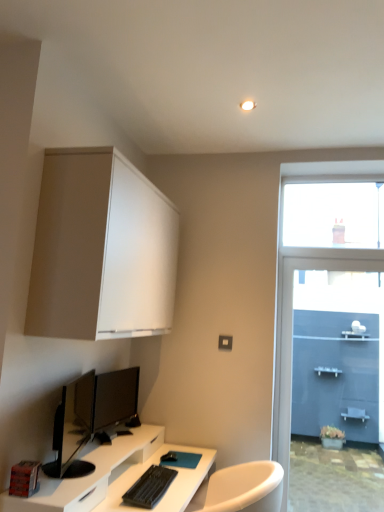
Question: Is transparent glass window at upper right in front of black glossy monitor at lower left, positioned as the 2th computer monitor in back-to-front order?

Choices:
 (A) no
 (B) yes

Answer: (A)

Question: From the image's perspective, is transparent glass window at upper right below black glossy monitor at lower left, placed as the first computer monitor when sorted from front to back?

Choices:
 (A) no
 (B) yes

Answer: (A)

Question: Is transparent glass window at upper right at the left side of black glossy monitor at lower left, positioned as the 2th computer monitor in back-to-front order?

Choices:
 (A) no
 (B) yes

Answer: (A)

Question: Is black glossy monitor at lower left, positioned as the 2th computer monitor in back-to-front order, located within transparent glass window at upper right?

Choices:
 (A) no
 (B) yes

Answer: (A)

Question: From the image's perspective, would you say transparent glass window at upper right is positioned over black glossy monitor at lower left, positioned as the 2th computer monitor in back-to-front order?

Choices:
 (A) yes
 (B) no

Answer: (A)

Question: In the image, is black glossy monitor at center, the 1th computer monitor when ordered from back to front, positioned in front of or behind black glossy monitor at lower left, placed as the first computer monitor when sorted from front to back?

Choices:
 (A) behind
 (B) front

Answer: (A)

Question: Is point (102, 382) positioned closer to the camera than point (87, 393)?

Choices:
 (A) closer
 (B) farther

Answer: (B)

Question: From a real-world perspective, is black glossy monitor at center, the 1th computer monitor when ordered from back to front, physically located above or below black glossy monitor at lower left, positioned as the 2th computer monitor in back-to-front order?

Choices:
 (A) above
 (B) below

Answer: (B)

Question: Looking at the image, does black glossy monitor at center, which appears as the second computer monitor when viewed from the front, seem bigger or smaller compared to black glossy monitor at lower left, positioned as the 2th computer monitor in back-to-front order?

Choices:
 (A) big
 (B) small

Answer: (B)

Question: From a real-world perspective, relative to black glossy monitor at lower left, placed as the first computer monitor when sorted from front to back, is matte white cabinet at upper left vertically above or below?

Choices:
 (A) above
 (B) below

Answer: (A)

Question: Would you say matte white cabinet at upper left is to the left or to the right of black glossy monitor at lower left, placed as the first computer monitor when sorted from front to back, in the picture?

Choices:
 (A) right
 (B) left

Answer: (A)

Question: In terms of width, does matte white cabinet at upper left look wider or thinner when compared to black glossy monitor at lower left, placed as the first computer monitor when sorted from front to back?

Choices:
 (A) wide
 (B) thin

Answer: (A)

Question: From the image's perspective, is matte white cabinet at upper left above or below black glossy monitor at lower left, placed as the first computer monitor when sorted from front to back?

Choices:
 (A) below
 (B) above

Answer: (B)

Question: Considering the positions of transparent glass window at upper right and matte white cabinet at upper left in the image, is transparent glass window at upper right wider or thinner than matte white cabinet at upper left?

Choices:
 (A) wide
 (B) thin

Answer: (B)

Question: Is transparent glass window at upper right inside or outside of matte white cabinet at upper left?

Choices:
 (A) inside
 (B) outside

Answer: (B)